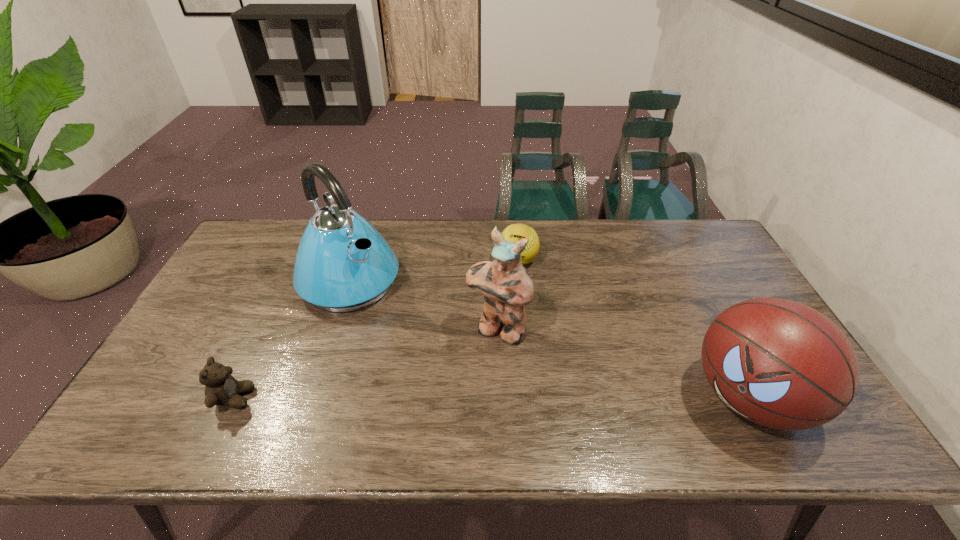
Find the location of a particular element. basketball that is at the near edge is located at coordinates (781, 364).

The image size is (960, 540). Identify the location of object that is positioned at the right edge. (781, 364).

Locate an element on the screen. The height and width of the screenshot is (540, 960). object that is positioned at the near right corner is located at coordinates (781, 364).

You are a GUI agent. You are given a task and a screenshot of the screen. Output one action in this format:
    pyautogui.click(x=<x>, y=<y>)
    Task: Click on the blank space at the far edge
    The image size is (960, 540).
    Given the screenshot: What is the action you would take?
    point(435,235)

At what (x,y) coordinates should I click in order to perform the action: click on free space at the left edge of the desktop. Please return your answer as a coordinate pair (x, y). The width and height of the screenshot is (960, 540). Looking at the image, I should click on (214, 357).

This screenshot has width=960, height=540. Find the location of `free region at the far right corner`. free region at the far right corner is located at coordinates (728, 255).

The height and width of the screenshot is (540, 960). I want to click on free spot between the teddy bear and the rightmost object, so click(492, 398).

Identify the location of free spot between the softball and the teddy bear. (376, 329).

What are the coordinates of `vacant area that lies between the figurine and the third shortest object` in the screenshot? It's located at [623, 363].

Identify the location of free spot between the tallest object and the rightmost object. (549, 340).